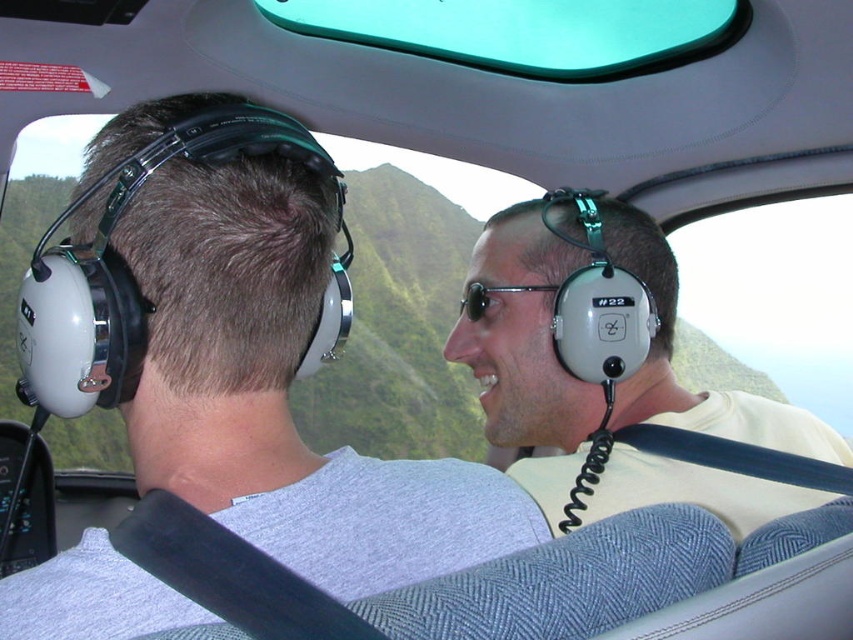
Question: Which of the following is the closest to the observer?

Choices:
 (A) (459, 308)
 (B) (624, 380)

Answer: (B)

Question: Does gray matte headset at center have a larger size compared to black plastic sunglasses at center?

Choices:
 (A) no
 (B) yes

Answer: (B)

Question: Can you confirm if gray matte headset at center is positioned above black plastic sunglasses at center?

Choices:
 (A) no
 (B) yes

Answer: (A)

Question: Which object appears farthest from the camera in this image?

Choices:
 (A) black plastic sunglasses at center
 (B) gray matte headset at center

Answer: (A)

Question: Among these objects, which one is nearest to the camera?

Choices:
 (A) gray matte headset at center
 (B) black plastic sunglasses at center

Answer: (A)

Question: Does gray matte headset at center appear over black plastic sunglasses at center?

Choices:
 (A) no
 (B) yes

Answer: (A)